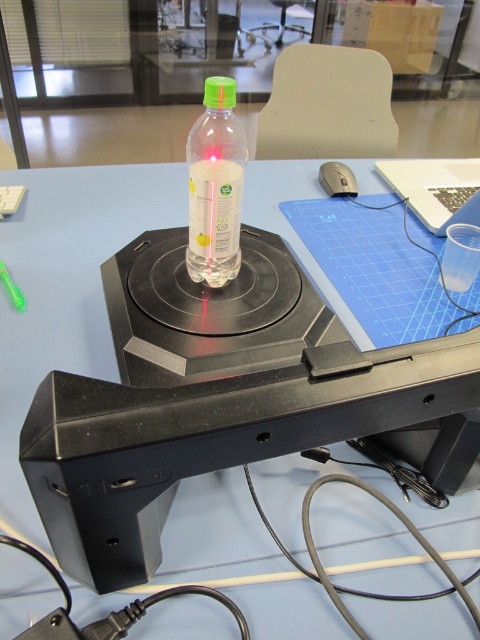
You are a student observing the experiment setup. The translucent plastic bottle at center and the black plastic mouse at right are both on the table. Which object is wider?

The translucent plastic bottle at center is wider than the black plastic mouse at right according to the description.

You are a student observing an experiment setup on a table. You see a translucent plastic bottle at center and a black plastic mouse at right. Which object is closer to the right edge of the table?

The black plastic mouse at right is closer to the right edge of the table because it is positioned to the right of the translucent plastic bottle at center.